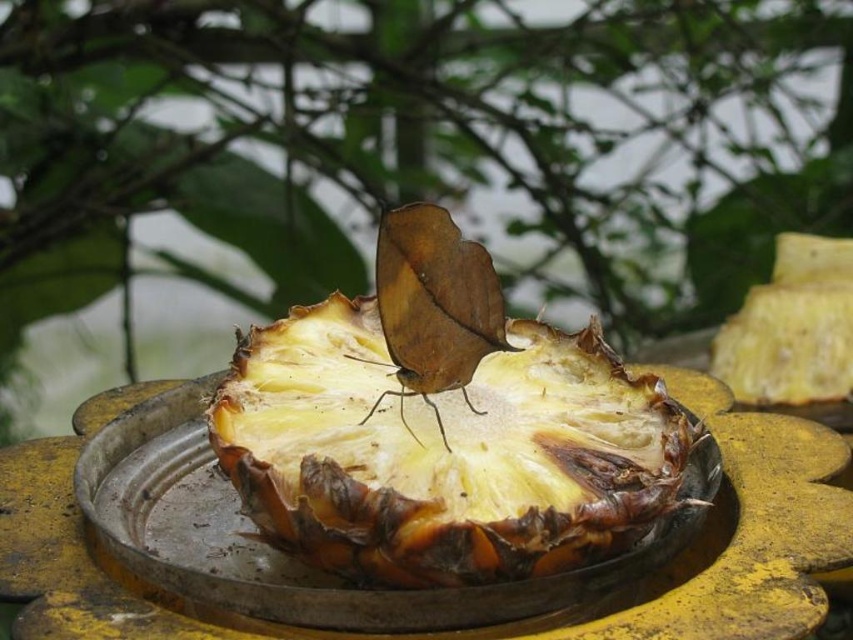
Is yellow matte pineapple at center shorter than brown matte butterfly at center?

In fact, yellow matte pineapple at center may be taller than brown matte butterfly at center.

What do you see at coordinates (445, 452) in the screenshot? The height and width of the screenshot is (640, 853). I see `yellow matte pineapple at center` at bounding box center [445, 452].

Which is behind, point (630, 528) or point (428, 387)?

The point (428, 387) is more distant.

Locate an element on the screen. yellow matte pineapple at center is located at coordinates (445, 452).